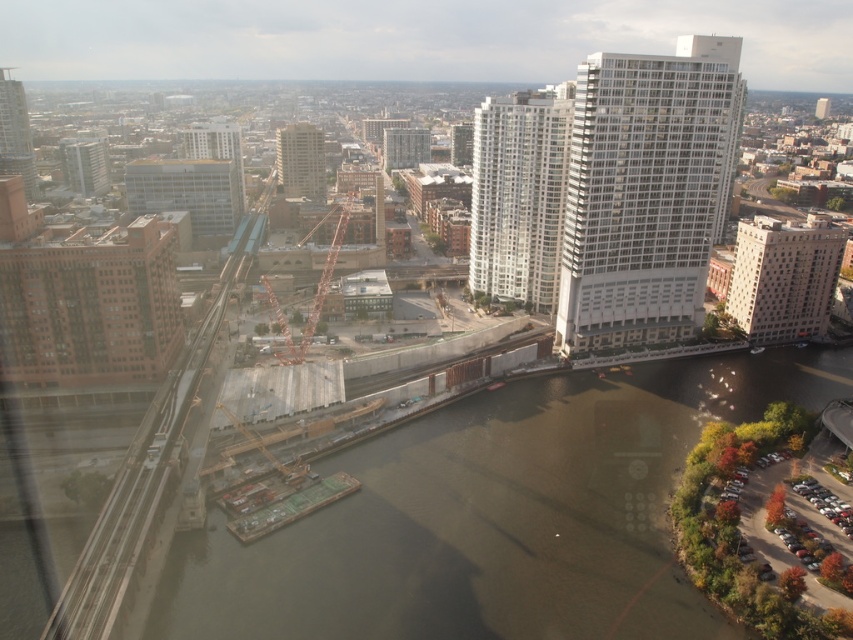
Locate an element on the screen. This screenshot has height=640, width=853. beige stone building at center right is located at coordinates (784, 276).

Consider the image. Who is positioned more to the left, beige stone building at center right or white glossy building at center?

Positioned to the left is white glossy building at center.

What do you see at coordinates (784, 276) in the screenshot? Image resolution: width=853 pixels, height=640 pixels. I see `beige stone building at center right` at bounding box center [784, 276].

Identify the location of beige stone building at center right. (784, 276).

Is the position of brown concrete waterway at center more distant than that of matte glass building at upper center?

No, it is not.

Does brown concrete waterway at center have a lesser width compared to matte glass building at upper center?

In fact, brown concrete waterway at center might be wider than matte glass building at upper center.

Between point (461, 483) and point (229, 129), which one is positioned in front?

Point (461, 483)

In order to click on brown concrete waterway at center in this screenshot , I will do `click(497, 516)`.

Is point (200, 141) closer to camera compared to point (425, 161)?

Yes, it is in front of point (425, 161).

From the picture: Is matte glass building at upper center thinner than matte gray building at center?

Incorrect, matte glass building at upper center's width is not less than matte gray building at center's.

The width and height of the screenshot is (853, 640). What do you see at coordinates (218, 148) in the screenshot? I see `matte glass building at upper center` at bounding box center [218, 148].

The image size is (853, 640). I want to click on matte glass building at upper center, so click(218, 148).